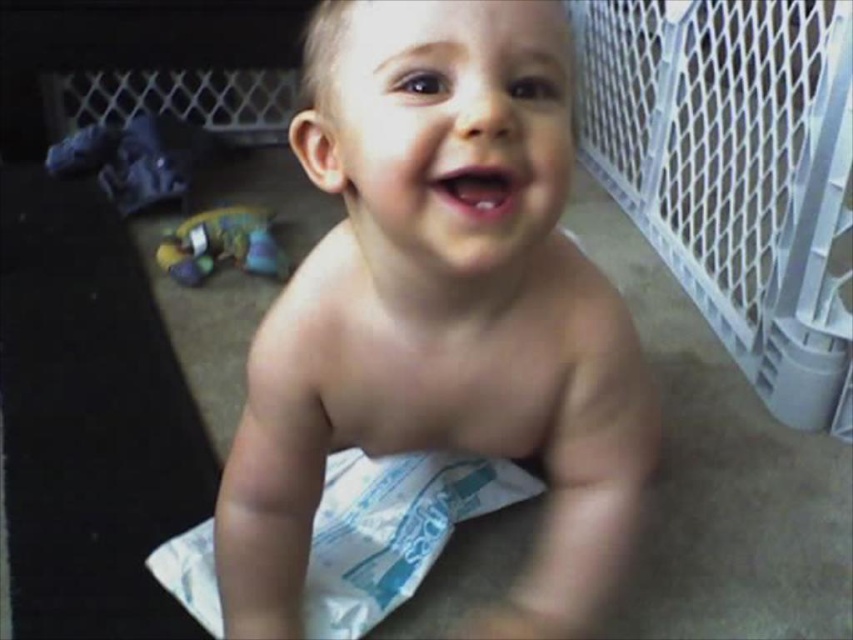
You are a photographer trying to capture a clear shot of the white paper diaper at center and the plush multicolored toy at lower left. Which object is positioned closer to the camera?

The white paper diaper at center is closer to the viewer than the plush multicolored toy at lower left, so the diaper will appear larger in the photo.

You are a photographer adjusting your camera to focus on two specific points in the image. The first point is at coordinates point (x=397, y=605) and the second is at point (x=209, y=253). Which point should you focus on first if you want to capture the closest object to the camera?

Point (x=397, y=605) is closer to the viewer than point (x=209, y=253), so you should focus on point (x=397, y=605) first to capture the closest object.

The child is wearing two diapers, a white cloth diaper at center and a white paper diaper at center. Which one is taller?

The white cloth diaper at center is taller than the white paper diaper at center.